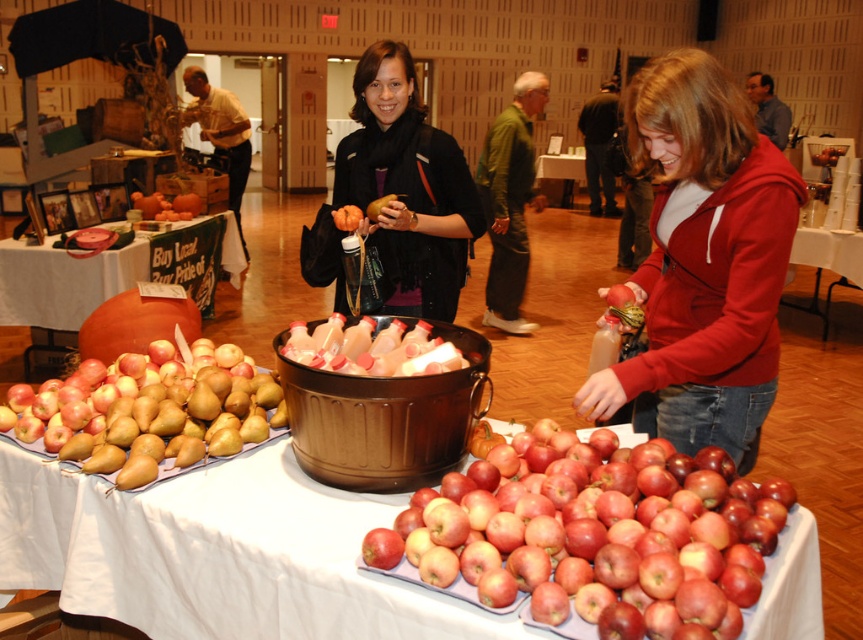
Between green textured sweater at center and white tablecloth at lower right, which one appears on the right side from the viewer's perspective?

white tablecloth at lower right is more to the right.

Does green textured sweater at center appear under white tablecloth at lower right?

Incorrect, green textured sweater at center is not positioned below white tablecloth at lower right.

Who is more distant from viewer, (483,160) or (808,253)?

The point (483,160) is behind.

Identify the location of green textured sweater at center. (509, 200).

Image resolution: width=863 pixels, height=640 pixels. Describe the element at coordinates (703, 262) in the screenshot. I see `red fleece jacket at lower right` at that location.

Which is behind, point (754, 406) or point (219, 260)?

Point (219, 260)

Where is `red fleece jacket at lower right`? red fleece jacket at lower right is located at coordinates (703, 262).

Who is shorter, green textured sweater at center or orange matte pumpkin at center?

With less height is orange matte pumpkin at center.

Is the position of green textured sweater at center less distant than that of orange matte pumpkin at center?

No, green textured sweater at center is behind orange matte pumpkin at center.

Find the location of a particular element. The height and width of the screenshot is (640, 863). green textured sweater at center is located at coordinates (509, 200).